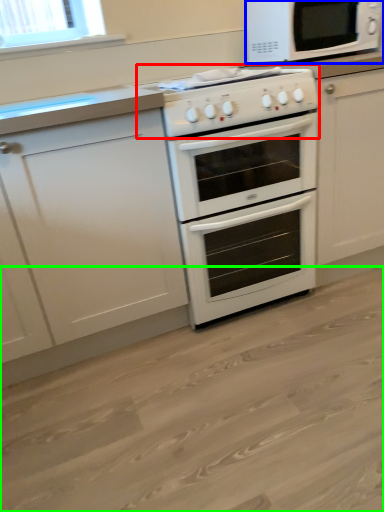
Question: Based on their relative distances, which object is nearer to gas stove (highlighted by a red box)? Choose from microwave oven (highlighted by a blue box) and plain (highlighted by a green box).

Choices:
 (A) microwave oven
 (B) plain

Answer: (A)